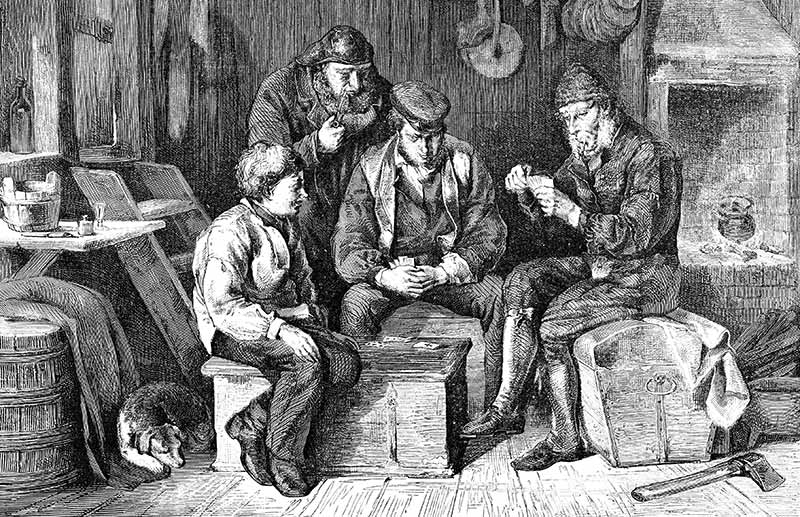
Locate an element on the screen. wooden bucket is located at coordinates (33, 210).